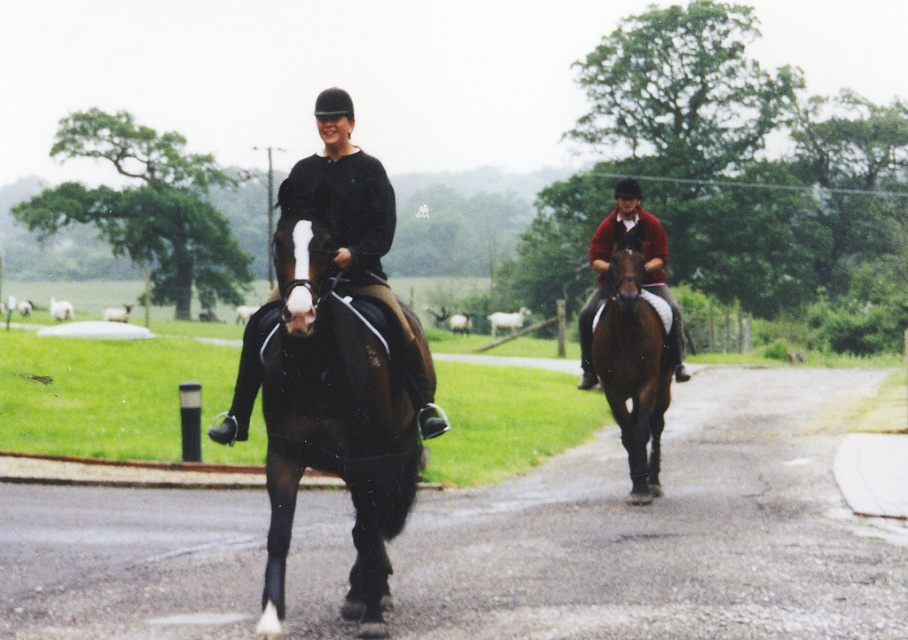
Based on the photo, you are a photographer trying to capture the rider in the black leather jacket at center. The camera is set to focus on the point at coordinates (358,230). Will this point be on the rider in the black leather jacket at center?

Yes, the point at coordinates (358,230) marks the black leather jacket at center, so the camera will focus on the rider in the black leather jacket at center.